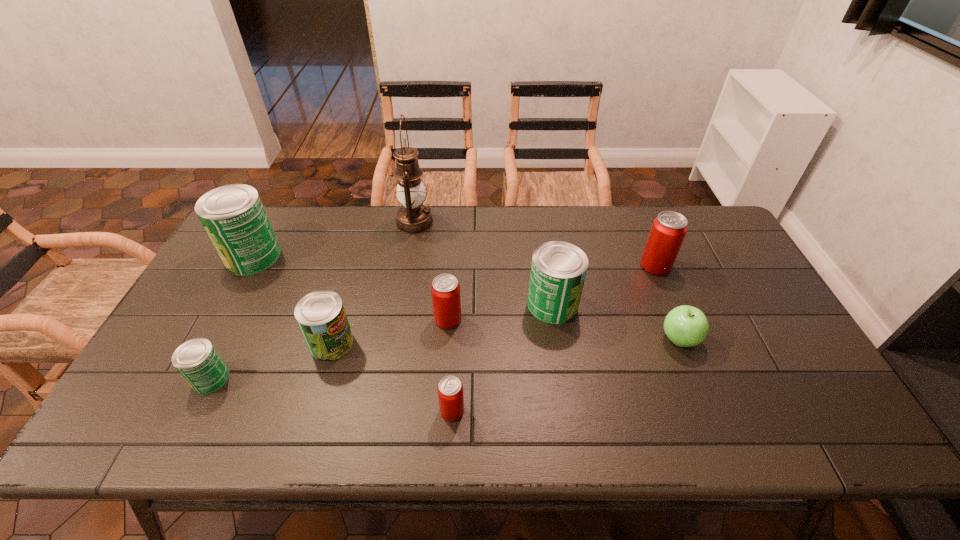
In the image, there is a desktop. Where is `vacant space at the near edge`? The image size is (960, 540). vacant space at the near edge is located at coordinates (419, 427).

This screenshot has width=960, height=540. Find the location of `blank area at the left edge`. blank area at the left edge is located at coordinates (215, 307).

The width and height of the screenshot is (960, 540). I want to click on vacant space at the right edge of the desktop, so click(x=787, y=358).

Where is `vacant space at the far right corner of the desktop`? This screenshot has width=960, height=540. vacant space at the far right corner of the desktop is located at coordinates (674, 210).

In order to click on vacant space at the near right corner of the desktop in this screenshot , I will do pyautogui.click(x=828, y=430).

Locate an element on the screen. free space between the sixth object from right to left and the nearest red can is located at coordinates tap(433, 316).

This screenshot has width=960, height=540. I want to click on free area in between the green apple and the second nearest red can, so click(564, 329).

At what (x,y) coordinates should I click in order to perform the action: click on vacant space that's between the green apple and the seventh object from left to right. Please return your answer as a coordinate pair (x, y). The image size is (960, 540). Looking at the image, I should click on (616, 322).

Identify the location of empty location between the tallest object and the fifth can from right to left. (373, 283).

Find the location of a particular element. The width and height of the screenshot is (960, 540). vacant area that lies between the third farthest green can and the second smallest red can is located at coordinates click(390, 331).